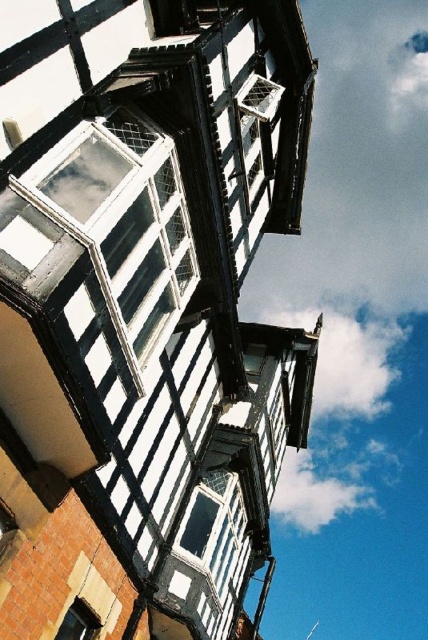
You are standing in front of the historic timber building and notice a white fluffy cloud at upper center and a white mesh window at upper center. Which object appears closer to you?

The white fluffy cloud at upper center appears closer to you because it is further to the viewer than the white mesh window at upper center.

You are standing near the historic timber building and want to take a photo of the white painted wood window at upper left. If your camera can focus on objects up to 30 feet away, will you be able to capture a clear image of it?

The white painted wood window at upper left is 25.06 feet away from viewer, so yes, the camera can focus on it clearly since it is within the 30 feet range.

You are an architect analyzing the building facade. You notice the white fluffy cloud at upper center and the matte black window at lower left. Which object takes up more space in the scene?

The white fluffy cloud at upper center takes up more space in the scene because it is bigger than the matte black window at lower left.